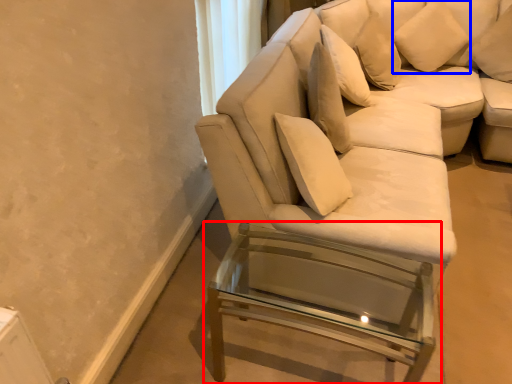
Question: Which point is further to the camera, table (highlighted by a red box) or pillow (highlighted by a blue box)?

Choices:
 (A) table
 (B) pillow

Answer: (B)